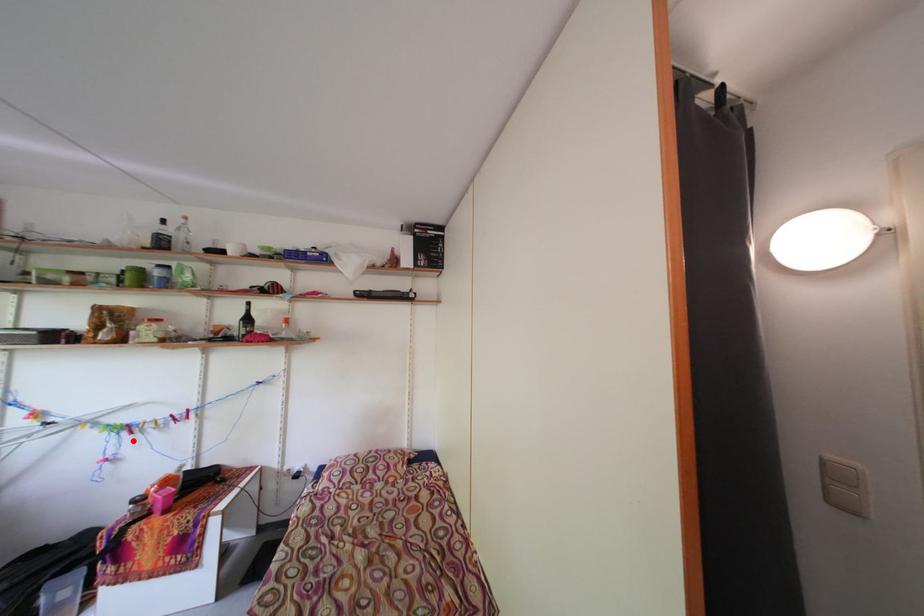
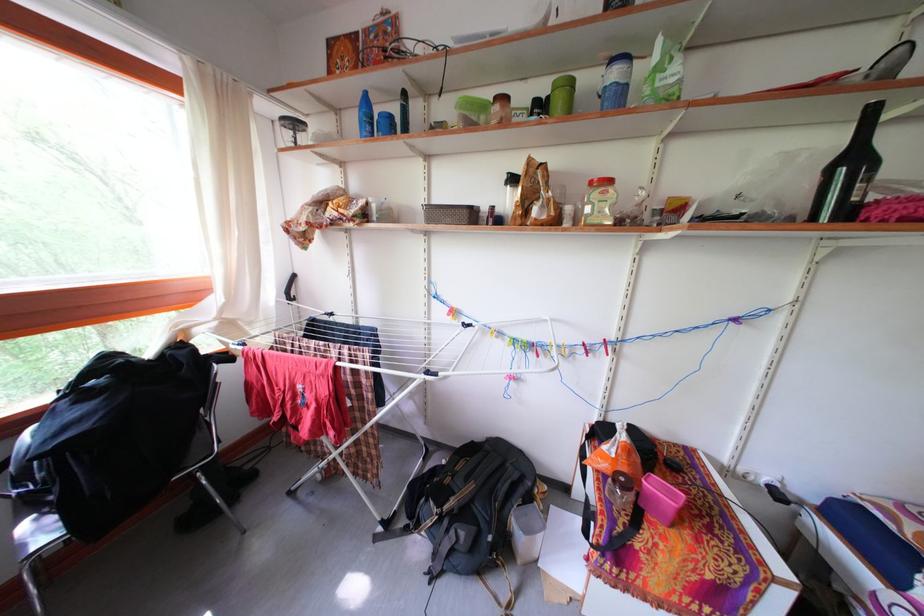
In the second image, find the point that corresponds to the highlighted location in the first image.

(540, 361)